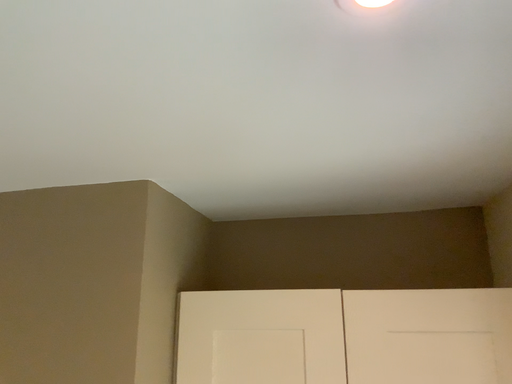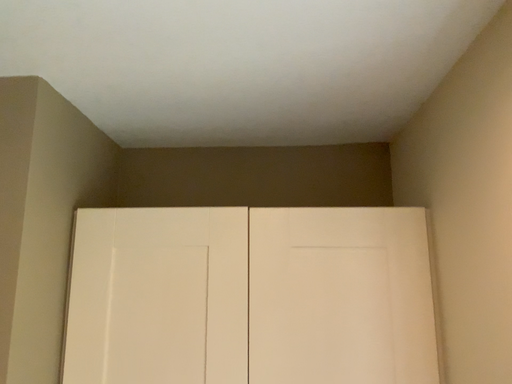
Question: How did the camera likely rotate when shooting the video?

Choices:
 (A) rotated left
 (B) rotated right

Answer: (B)